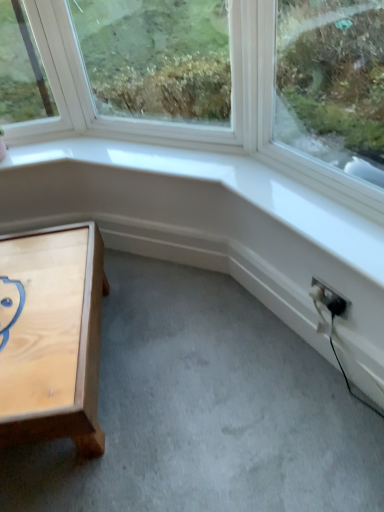
The image size is (384, 512). What do you see at coordinates (331, 298) in the screenshot?
I see `black plastic electric outlet at lower right` at bounding box center [331, 298].

Locate an element on the screen. black plastic electric outlet at lower right is located at coordinates (331, 298).

What do you see at coordinates (51, 335) in the screenshot?
I see `light wood table at lower left` at bounding box center [51, 335].

The image size is (384, 512). I want to click on light wood table at lower left, so click(51, 335).

What is the approximate height of light wood table at lower left?

It is 33.88 centimeters.

Where is `black plastic electric outlet at lower right`? The width and height of the screenshot is (384, 512). black plastic electric outlet at lower right is located at coordinates point(331,298).

Is light wood table at lower left to the left or to the right of black plastic electric outlet at lower right in the image?

Based on their positions, light wood table at lower left is located to the left of black plastic electric outlet at lower right.

Considering the positions of objects light wood table at lower left and black plastic electric outlet at lower right in the image provided, who is in front, light wood table at lower left or black plastic electric outlet at lower right?

light wood table at lower left is closer to the camera.

Is point (81, 380) closer to viewer compared to point (333, 303)?

Yes, point (81, 380) is in front of point (333, 303).

From the image's perspective, does light wood table at lower left appear higher than black plastic electric outlet at lower right?

Incorrect, from the image's perspective, light wood table at lower left is lower than black plastic electric outlet at lower right.

From a real-world perspective, who is located lower, light wood table at lower left or black plastic electric outlet at lower right?

From a 3D spatial view, light wood table at lower left is below.

In terms of width, does light wood table at lower left look wider or thinner when compared to black plastic electric outlet at lower right?

Considering their sizes, light wood table at lower left looks broader than black plastic electric outlet at lower right.

Between light wood table at lower left and black plastic electric outlet at lower right, which one has more height?

Standing taller between the two is light wood table at lower left.

Which of these two, light wood table at lower left or black plastic electric outlet at lower right, is bigger?

light wood table at lower left.

Can we say light wood table at lower left lies outside black plastic electric outlet at lower right?

That's correct, light wood table at lower left is outside of black plastic electric outlet at lower right.

Is there a large distance between light wood table at lower left and black plastic electric outlet at lower right?

light wood table at lower left is actually quite close to black plastic electric outlet at lower right.

Does light wood table at lower left turn towards black plastic electric outlet at lower right?

No, light wood table at lower left is not turned towards black plastic electric outlet at lower right.

What's the angular difference between light wood table at lower left and black plastic electric outlet at lower right's facing directions?

The angular difference between light wood table at lower left and black plastic electric outlet at lower right is 61.5 degrees.

In order to click on electric outlet above the light wood table at lower left (from a real-world perspective) in this screenshot , I will do `click(331, 298)`.

Is black plastic electric outlet at lower right to the left or to the right of light wood table at lower left in the image?

black plastic electric outlet at lower right is to the right of light wood table at lower left.

Is the position of black plastic electric outlet at lower right less distant than that of light wood table at lower left?

That is False.

Does point (334, 309) appear closer or farther from the camera than point (99, 269)?

Point (334, 309) is closer to the camera than point (99, 269).

From the image's perspective, who appears lower, black plastic electric outlet at lower right or light wood table at lower left?

light wood table at lower left is shown below in the image.

Based on the photo, from a real-world perspective, is black plastic electric outlet at lower right below light wood table at lower left?

No.

Considering the sizes of black plastic electric outlet at lower right and light wood table at lower left in the image, is black plastic electric outlet at lower right wider or thinner than light wood table at lower left?

In the image, black plastic electric outlet at lower right appears to be more narrow than light wood table at lower left.

Can you confirm if black plastic electric outlet at lower right is shorter than light wood table at lower left?

Correct, black plastic electric outlet at lower right is not as tall as light wood table at lower left.

Can you confirm if black plastic electric outlet at lower right is bigger than light wood table at lower left?

Incorrect, black plastic electric outlet at lower right is not larger than light wood table at lower left.

Is black plastic electric outlet at lower right spatially inside light wood table at lower left, or outside of it?

black plastic electric outlet at lower right is not inside light wood table at lower left, it's outside.

Are black plastic electric outlet at lower right and light wood table at lower left located far from each other?

black plastic electric outlet at lower right is near light wood table at lower left, not far away.

Is light wood table at lower left at the back of black plastic electric outlet at lower right?

black plastic electric outlet at lower right does not have its back to light wood table at lower left.

How much distance is there between black plastic electric outlet at lower right and light wood table at lower left?

black plastic electric outlet at lower right and light wood table at lower left are 35.55 inches apart from each other.

The width and height of the screenshot is (384, 512). What are the coordinates of `table that is on the left side of black plastic electric outlet at lower right` in the screenshot? It's located at (51, 335).

Where is `table that is in front of the black plastic electric outlet at lower right`? This screenshot has height=512, width=384. table that is in front of the black plastic electric outlet at lower right is located at coordinates (51, 335).

This screenshot has height=512, width=384. In order to click on electric outlet above the light wood table at lower left (from a real-world perspective) in this screenshot , I will do `click(331, 298)`.